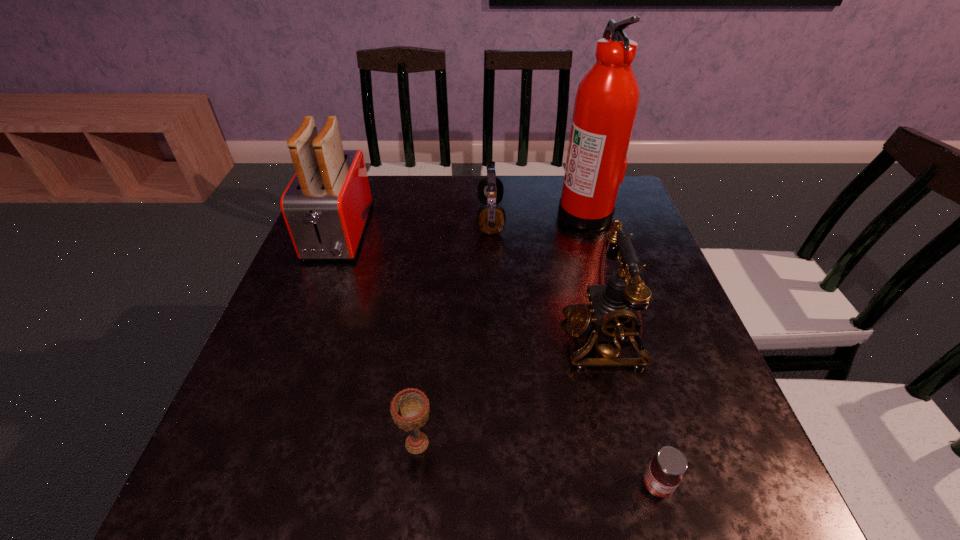
Find the location of a particular element. free space that satisfies the following two spatial constraints: 1. on the front of the telephone, featuring the rotary dial; 2. on the front side of the chalice is located at coordinates coord(631,444).

Locate an element on the screen. free spot that satisfies the following two spatial constraints: 1. on the label side of the fire extinguisher; 2. on the label side of the jam is located at coordinates (666, 485).

Where is `vacant position in the image that satisfies the following two spatial constraints: 1. on the label side of the tallest object; 2. on the label side of the jam`? The height and width of the screenshot is (540, 960). vacant position in the image that satisfies the following two spatial constraints: 1. on the label side of the tallest object; 2. on the label side of the jam is located at coordinates (666, 485).